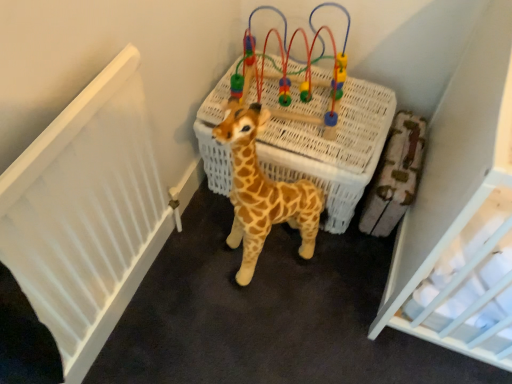
Question: Is white wicker basket at center positioned behind spotted plush giraffe at center?

Choices:
 (A) yes
 (B) no

Answer: (A)

Question: Is white wicker basket at center beside spotted plush giraffe at center?

Choices:
 (A) yes
 (B) no

Answer: (B)

Question: Is spotted plush giraffe at center at the back of white wicker basket at center?

Choices:
 (A) no
 (B) yes

Answer: (A)

Question: Considering the relative sizes of white wicker basket at center and spotted plush giraffe at center in the image provided, is white wicker basket at center shorter than spotted plush giraffe at center?

Choices:
 (A) yes
 (B) no

Answer: (A)

Question: Can you confirm if white wicker basket at center is positioned to the left of spotted plush giraffe at center?

Choices:
 (A) no
 (B) yes

Answer: (A)

Question: From a real-world perspective, is white wicker basket at center above or below wooden bead maze at center?

Choices:
 (A) above
 (B) below

Answer: (B)

Question: Which is correct: white wicker basket at center is inside wooden bead maze at center, or outside of it?

Choices:
 (A) outside
 (B) inside

Answer: (A)

Question: Considering the positions of white wicker basket at center and wooden bead maze at center in the image, is white wicker basket at center taller or shorter than wooden bead maze at center?

Choices:
 (A) short
 (B) tall

Answer: (B)

Question: Looking at the image, does white wicker basket at center seem bigger or smaller compared to wooden bead maze at center?

Choices:
 (A) small
 (B) big

Answer: (B)

Question: Considering the positions of wooden bead maze at center and spotted plush giraffe at center in the image, is wooden bead maze at center bigger or smaller than spotted plush giraffe at center?

Choices:
 (A) small
 (B) big

Answer: (A)

Question: Would you say wooden bead maze at center is to the left or to the right of spotted plush giraffe at center in the picture?

Choices:
 (A) right
 (B) left

Answer: (A)

Question: From the image's perspective, is wooden bead maze at center positioned above or below spotted plush giraffe at center?

Choices:
 (A) below
 (B) above

Answer: (B)

Question: From a real-world perspective, relative to spotted plush giraffe at center, is wooden bead maze at center vertically above or below?

Choices:
 (A) above
 (B) below

Answer: (A)

Question: In the image, is spotted plush giraffe at center on the left side or the right side of wooden bead maze at center?

Choices:
 (A) right
 (B) left

Answer: (B)

Question: Considering the positions of spotted plush giraffe at center and wooden bead maze at center in the image, is spotted plush giraffe at center wider or thinner than wooden bead maze at center?

Choices:
 (A) thin
 (B) wide

Answer: (A)